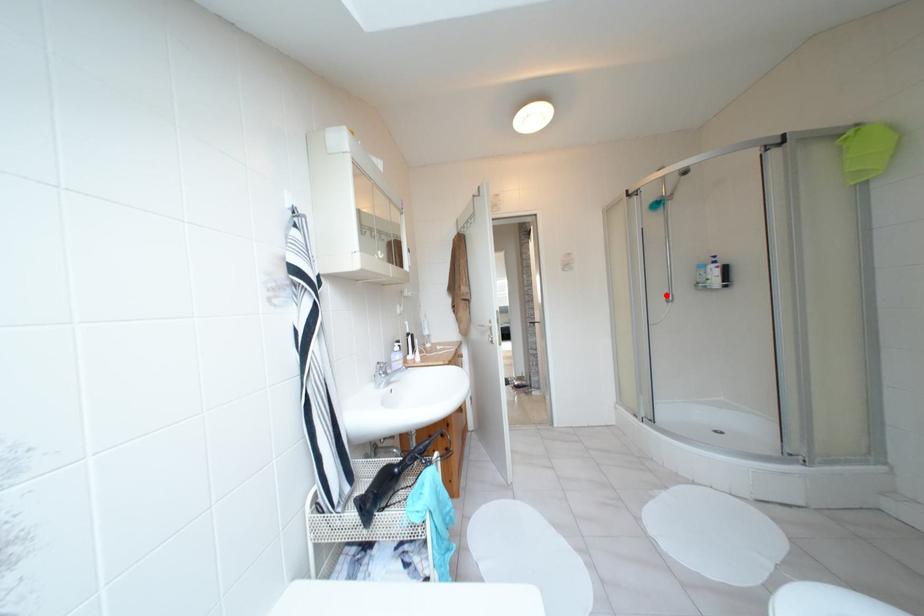
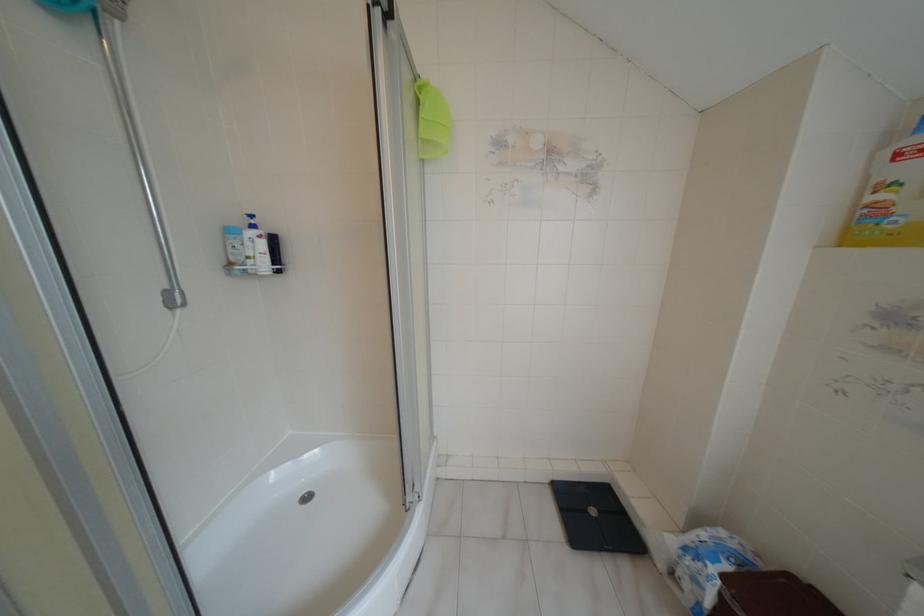
Locate, in the second image, the point that corresponds to the highlighted location in the first image.

(166, 293)